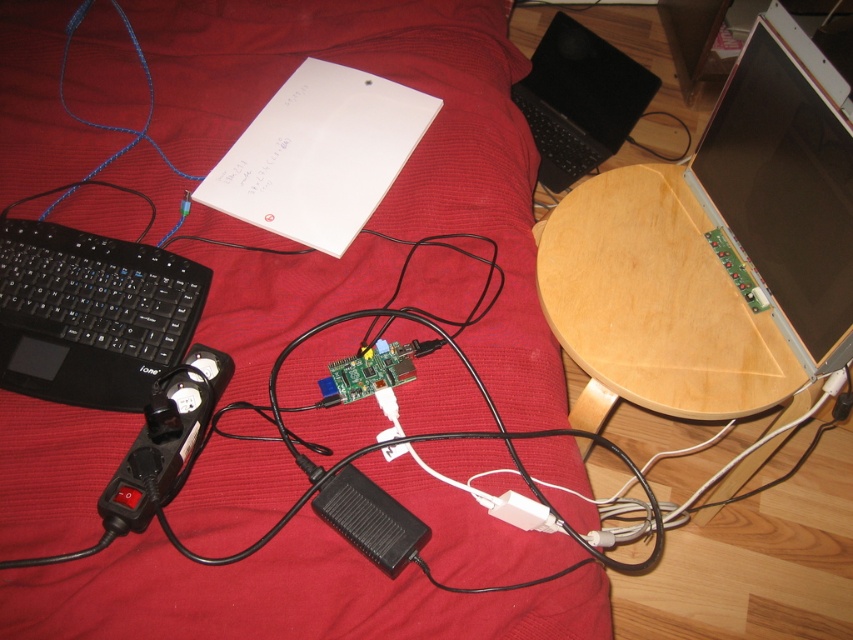
Question: Which point is farther to the camera?

Choices:
 (A) red fabric bed at center
 (B) black plastic keyboard at left
 (C) black plastic laptop at upper center

Answer: (C)

Question: Which point appears closest to the camera in this image?

Choices:
 (A) (227, 468)
 (B) (57, 326)

Answer: (A)

Question: Where is black plastic keyboard at left located in relation to black plastic laptop at upper center in the image?

Choices:
 (A) left
 (B) right

Answer: (A)

Question: Does red fabric bed at center appear on the right side of black plastic laptop at upper center?

Choices:
 (A) yes
 (B) no

Answer: (B)

Question: Does black plastic keyboard at left appear on the left side of black plastic laptop at upper center?

Choices:
 (A) no
 (B) yes

Answer: (B)

Question: Which point is closer to the camera?

Choices:
 (A) red fabric bed at center
 (B) black plastic laptop at upper center
 (C) black plastic keyboard at left

Answer: (A)